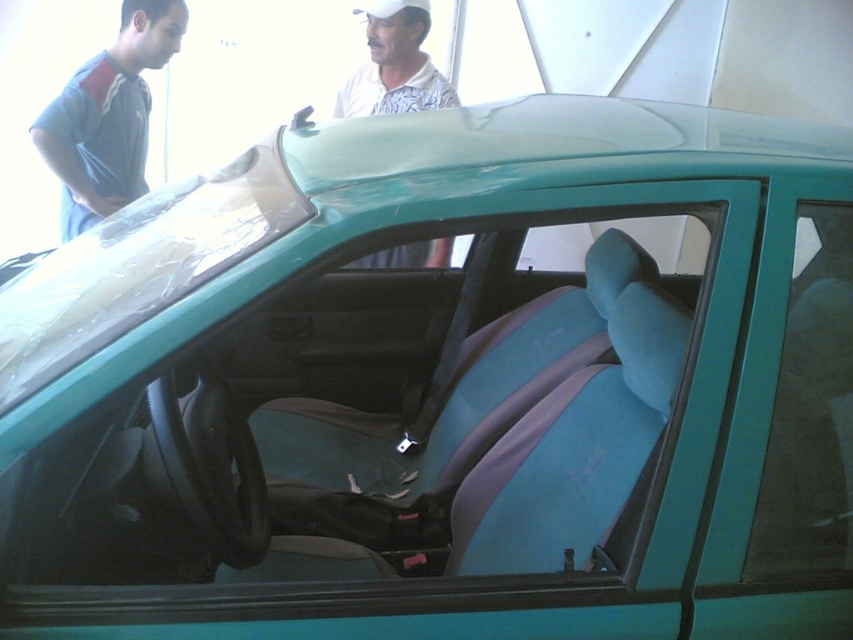
You are a photographer trying to capture both the gray fabric shirt at upper left and the white printed shirt at upper center in a single shot. Based on their positions, which shirt should you focus on first to ensure both are in frame?

The gray fabric shirt at upper left is below the white printed shirt at upper center, so you should focus on the white printed shirt at upper center first to ensure both are in frame.

You are a tailor observing two shirts in the scene. The gray fabric shirt at upper left and the white printed shirt at upper center. Which shirt has a bigger size?

The gray fabric shirt at upper left has a larger size compared to the white printed shirt at upper center.